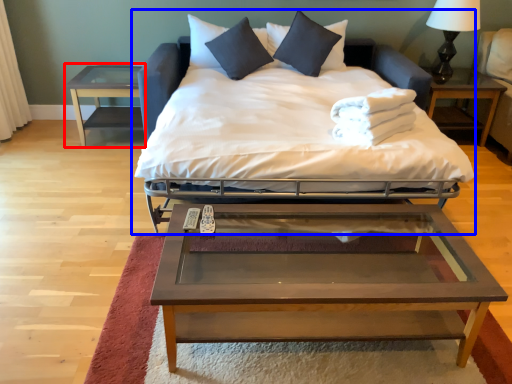
Question: Which of the following is the closest to the observer, nightstand (highlighted by a red box) or bed (highlighted by a blue box)?

Choices:
 (A) nightstand
 (B) bed

Answer: (B)